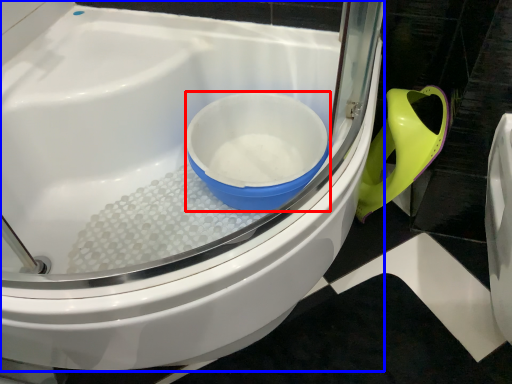
Question: Which object appears farthest to the camera in this image, mixing bowl (highlighted by a red box) or toilet (highlighted by a blue box)?

Choices:
 (A) mixing bowl
 (B) toilet

Answer: (A)